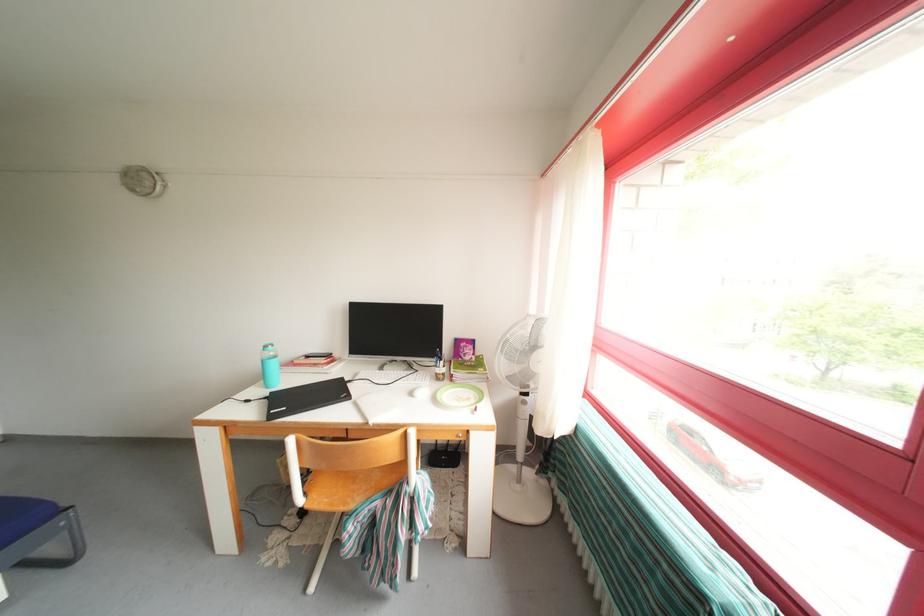
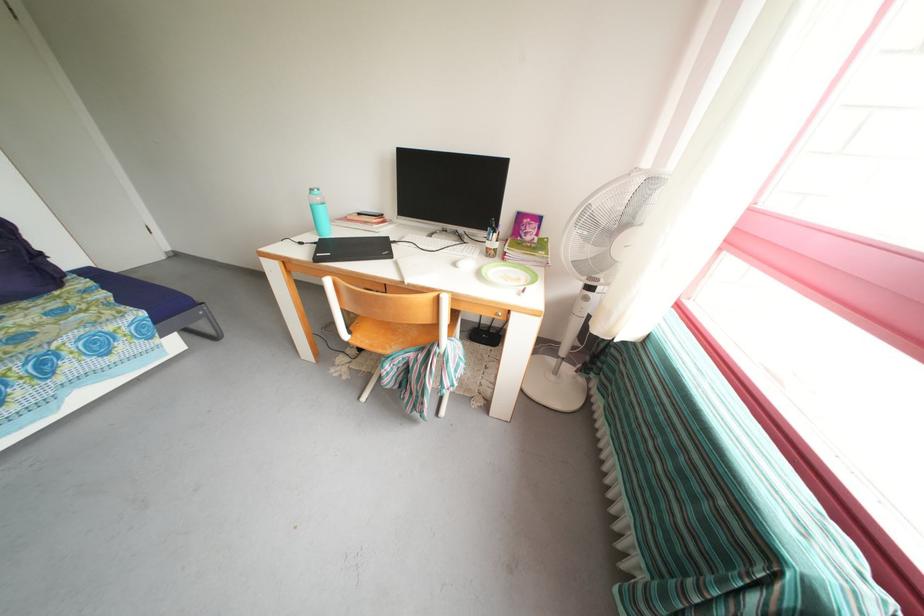
Find the pixel in the second image that matches the point at 520,399 in the first image.

(582, 293)